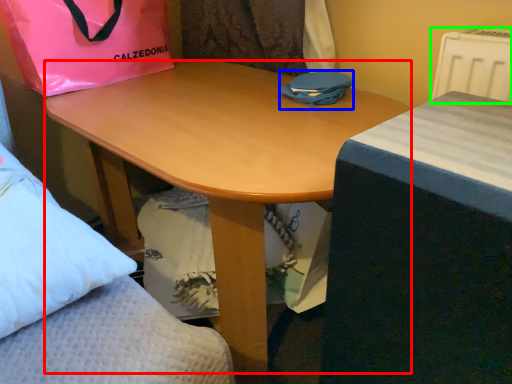
Question: Which object is the closest to the desk (highlighted by a red box)? Choose among these: bag (highlighted by a blue box) or radiator (highlighted by a green box).

Choices:
 (A) bag
 (B) radiator

Answer: (A)